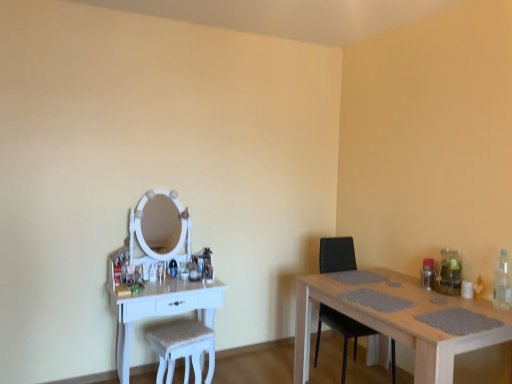
At what (x,y) coordinates should I click in order to perform the action: click on vacant area that lies to the right of white wood table at left, which is the second table in right-to-left order. Please return your answer as a coordinate pair (x, y). The image size is (512, 384). Looking at the image, I should click on (250, 369).